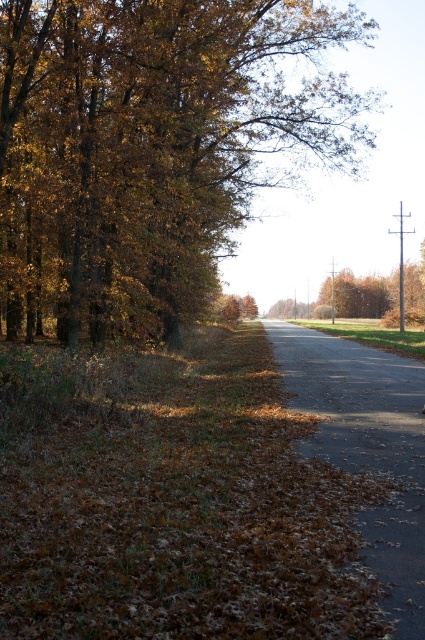
You are standing at the center of the road in the image. Looking towards the horizon, which side of the road has the brown leafy tree at left?

The brown leafy tree at left is located on the left side of the road.

You are standing on the gravel road at center and want to know if the brown leafy tree at left is wider than the road itself. Can you confirm?

The brown leafy tree at left is wider than the gravel road at center, so yes, the brown leafy tree at left is wider than the road itself.